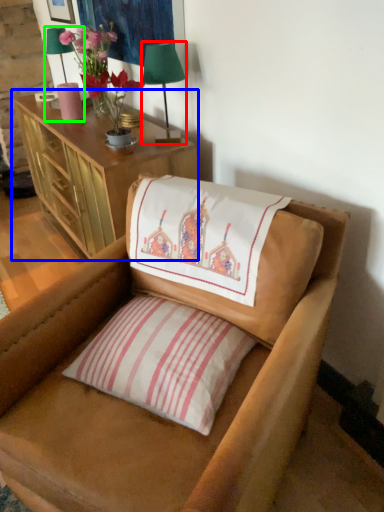
Question: Based on their relative distances, which object is nearer to table lamp (highlighted by a red box)? Choose from cabinetry (highlighted by a blue box) and table lamp (highlighted by a green box).

Choices:
 (A) cabinetry
 (B) table lamp

Answer: (B)